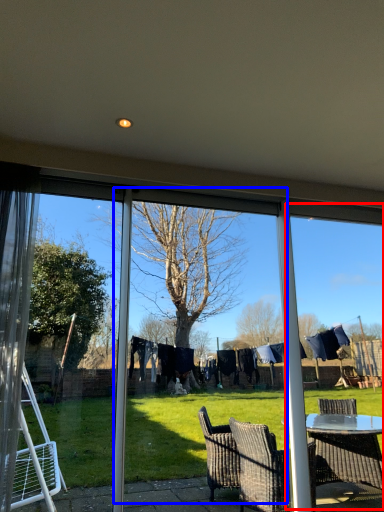
Question: Which of the following is the closest to the observer, window frame (highlighted by a red box) or screen door (highlighted by a blue box)?

Choices:
 (A) window frame
 (B) screen door

Answer: (B)